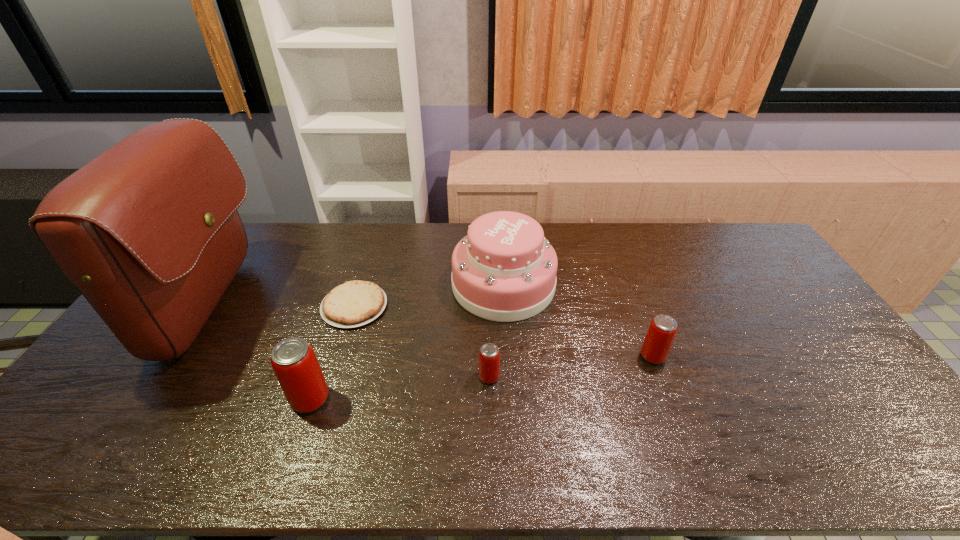
Identify the location of free space located on the left of the third tallest object. This screenshot has width=960, height=540. (198, 399).

This screenshot has height=540, width=960. I want to click on free space located on the right of the second beer can from left to right, so click(544, 376).

Identify the location of free location located on the front of the second tallest beer can. This screenshot has width=960, height=540. (663, 384).

Identify the location of vacant space located on the open flap of the leftmost object. (341, 307).

In order to click on free point located on the left of the shortest object in this screenshot , I will do `click(198, 306)`.

The height and width of the screenshot is (540, 960). Find the location of `vacant area situated 0.180m on the left of the second tallest object`. vacant area situated 0.180m on the left of the second tallest object is located at coordinates (397, 285).

This screenshot has height=540, width=960. In order to click on satchel that is at the far edge in this screenshot , I will do `click(148, 231)`.

Find the location of `cake at the far edge`. cake at the far edge is located at coordinates [504, 270].

Locate an element on the screen. object positioned at the near edge is located at coordinates (294, 362).

What are the coordinates of `object situated at the left edge` in the screenshot? It's located at (148, 231).